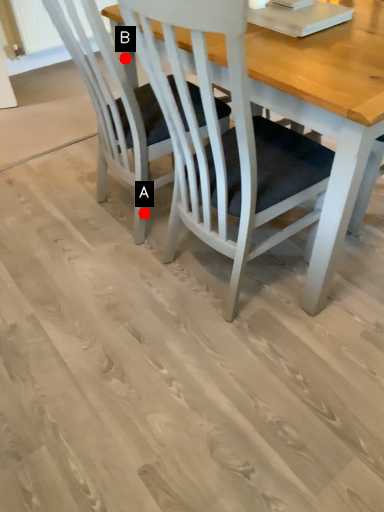
Question: Two points are circled on the image, labeled by A and B beside each circle. Which of the following is the closest to the observer?

Choices:
 (A) A is closer
 (B) B is closer

Answer: (B)